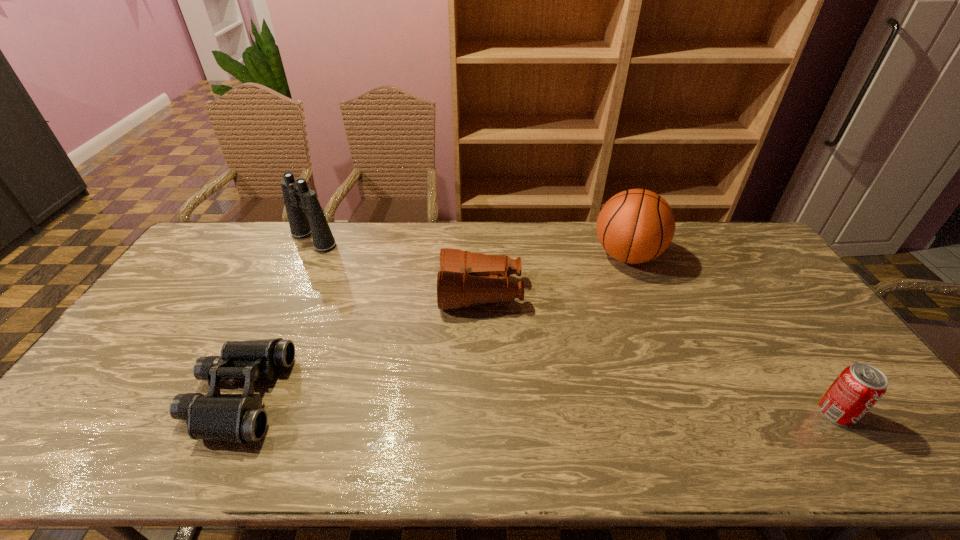
Image resolution: width=960 pixels, height=540 pixels. Identify the location of free space located 0.110m through the lenses of the third object from left to right. (406, 293).

Find the location of a particular element. The image size is (960, 540). free space located through the lenses of the third object from left to right is located at coordinates 378,293.

Locate an element on the screen. This screenshot has height=540, width=960. free space located through the lenses of the third object from left to right is located at coordinates (359, 293).

The image size is (960, 540). What are the coordinates of `blank space located 0.400m on the front-facing side of the nearest binoculars` in the screenshot? It's located at (440, 396).

Identify the location of binoculars situated at the far edge. (299, 200).

Locate an element on the screen. basketball that is at the far edge is located at coordinates (634, 226).

This screenshot has height=540, width=960. I want to click on object present at the near edge, so click(239, 418).

Identify the location of object at the right edge. (856, 390).

I want to click on vacant position at the far edge of the desktop, so click(x=240, y=257).

The height and width of the screenshot is (540, 960). I want to click on free space at the left edge of the desktop, so click(x=203, y=262).